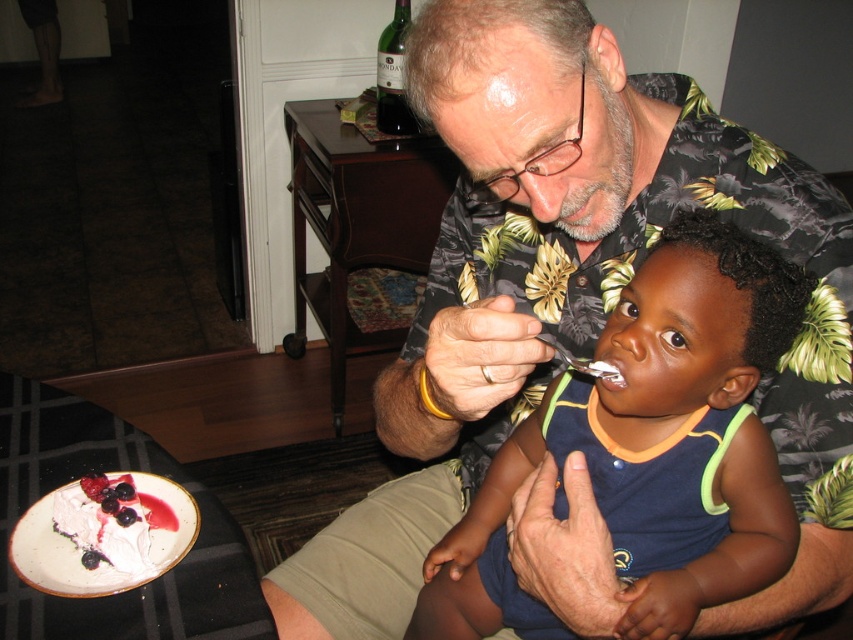
Which is more to the left, floral shirt at center or whipped cream topped with berries at lower left?

Positioned to the left is whipped cream topped with berries at lower left.

Who is more forward, (440, 32) or (169, 515)?

Point (440, 32) is more forward.

Who is more distant from viewer, (543,307) or (109,545)?

Point (543,307)

I want to click on floral shirt at center, so [x=572, y=298].

Is matte blue shirt at center smaller than whipped cream topped with berries at lower left?

Incorrect, matte blue shirt at center is not smaller in size than whipped cream topped with berries at lower left.

Between point (680, 348) and point (67, 509), which one is positioned behind?

Point (67, 509)

Where is `matte blue shirt at center`? This screenshot has width=853, height=640. matte blue shirt at center is located at coordinates (648, 449).

Which is above, floral shirt at center or matte blue shirt at center?

floral shirt at center

Who is positioned more to the right, floral shirt at center or matte blue shirt at center?

From the viewer's perspective, matte blue shirt at center appears more on the right side.

Which is in front, point (587, 561) or point (679, 232)?

Positioned in front is point (587, 561).

Find the location of a particular element. floral shirt at center is located at coordinates (572, 298).